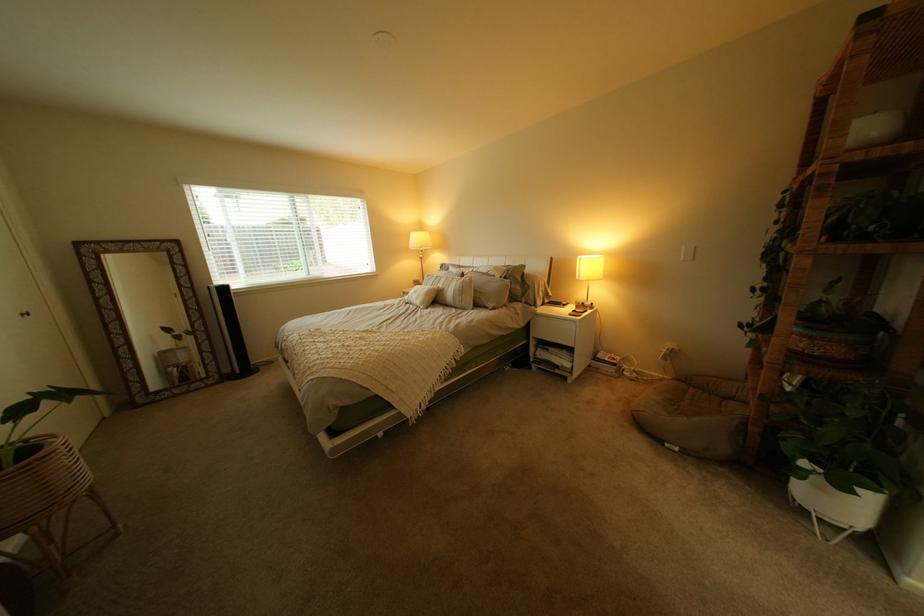
Find the location of a particular element. The width and height of the screenshot is (924, 616). white ceramic pot is located at coordinates (834, 503).